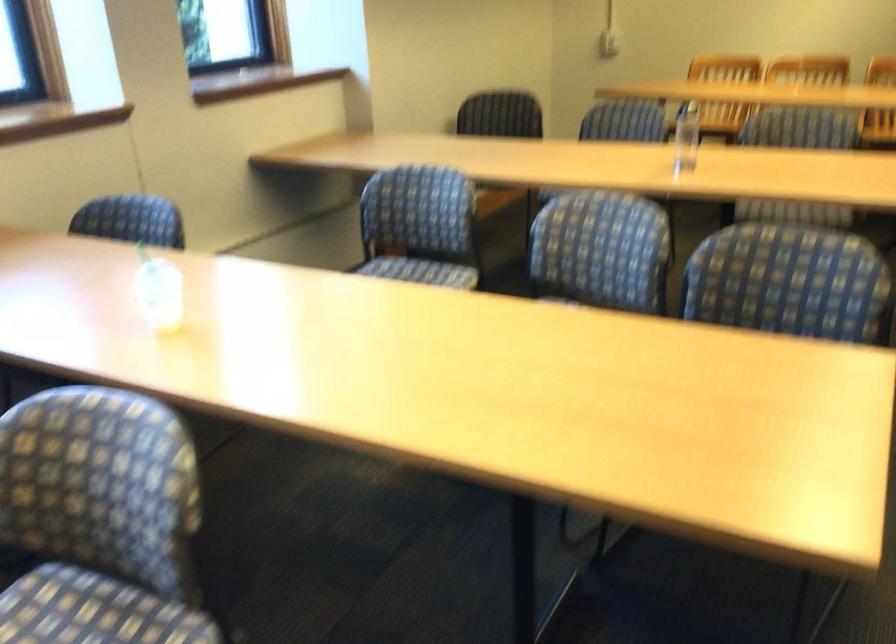
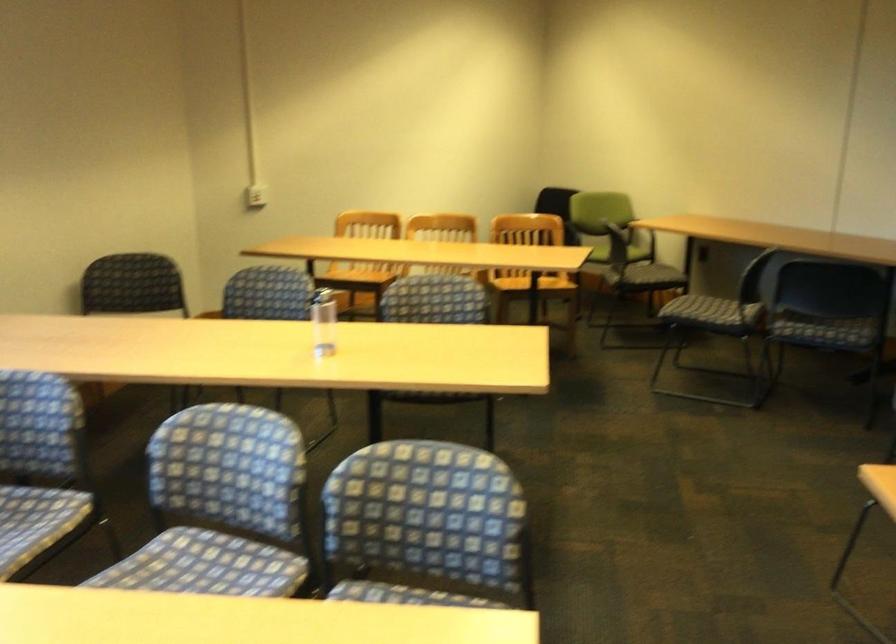
Locate, in the second image, the point that corresponds to [780,299] in the first image.

(425, 527)